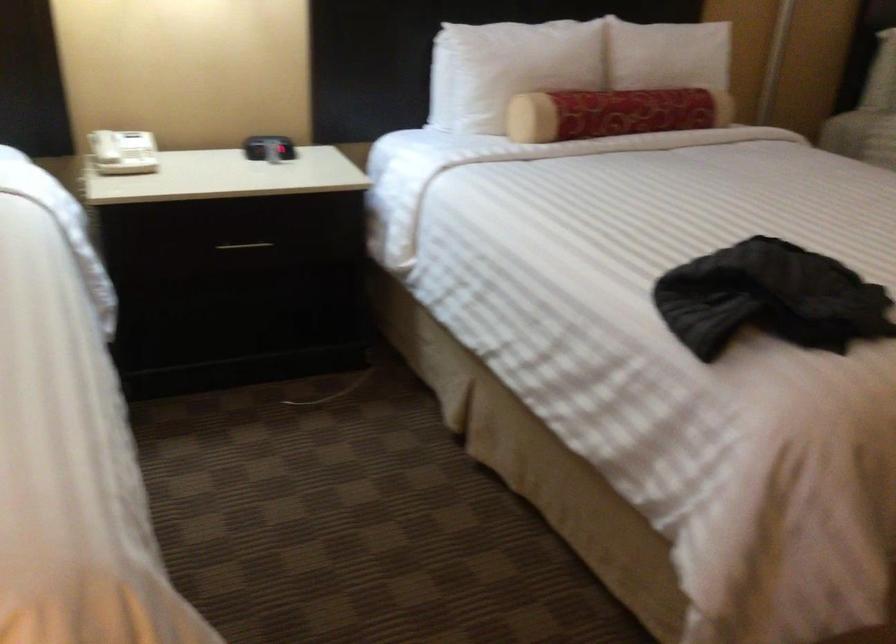
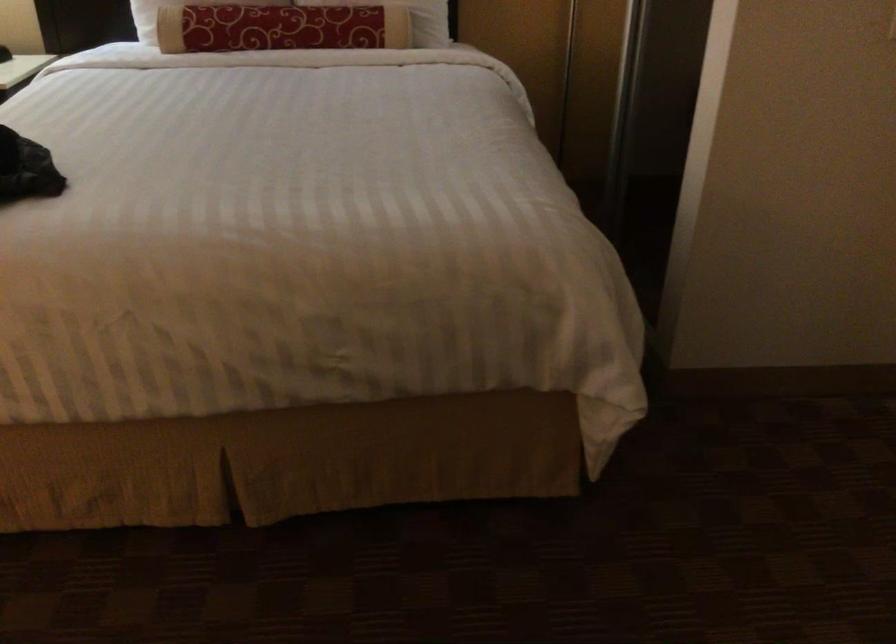
Locate, in the second image, the point that corresponds to pixel 642 107 in the first image.

(280, 28)